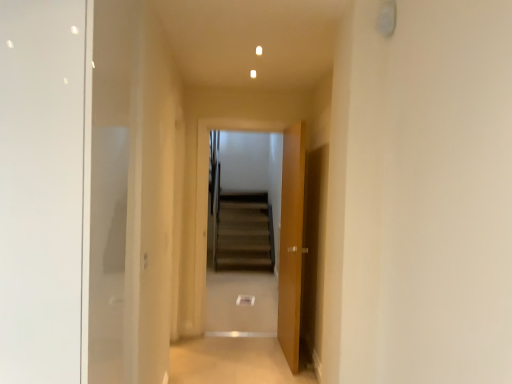
The image size is (512, 384). In order to click on empty space that is ontop of brown carpeted stairs at center in this screenshot , I will do `click(234, 115)`.